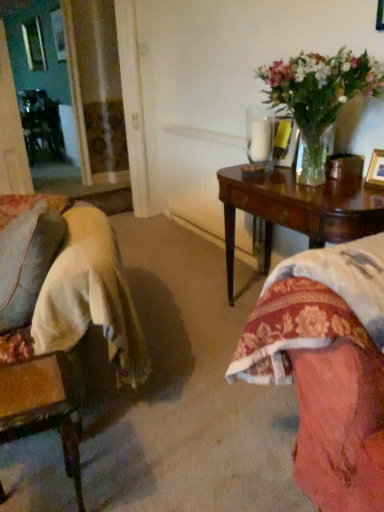
Question: Is clear glass vase at upper right to the left or to the right of mahogany wood table at right in the image?

Choices:
 (A) right
 (B) left

Answer: (A)

Question: Is clear glass vase at upper right wider or thinner than mahogany wood table at right?

Choices:
 (A) thin
 (B) wide

Answer: (A)

Question: Which object is the closest to the white textured radiator at center?

Choices:
 (A) wooden picture frame at upper right
 (B) wooden swivel chair at lower left
 (C) clear glass vase at upper right
 (D) mahogany wood table at right
 (E) clear glass vase at upper right

Answer: (D)

Question: Which is farther from the wooden picture frame at upper right?

Choices:
 (A) velvet beige chair at left
 (B) white textured radiator at center
 (C) clear glass vase at upper right
 (D) mahogany wood table at right
 (E) clear glass vase at upper right

Answer: (B)